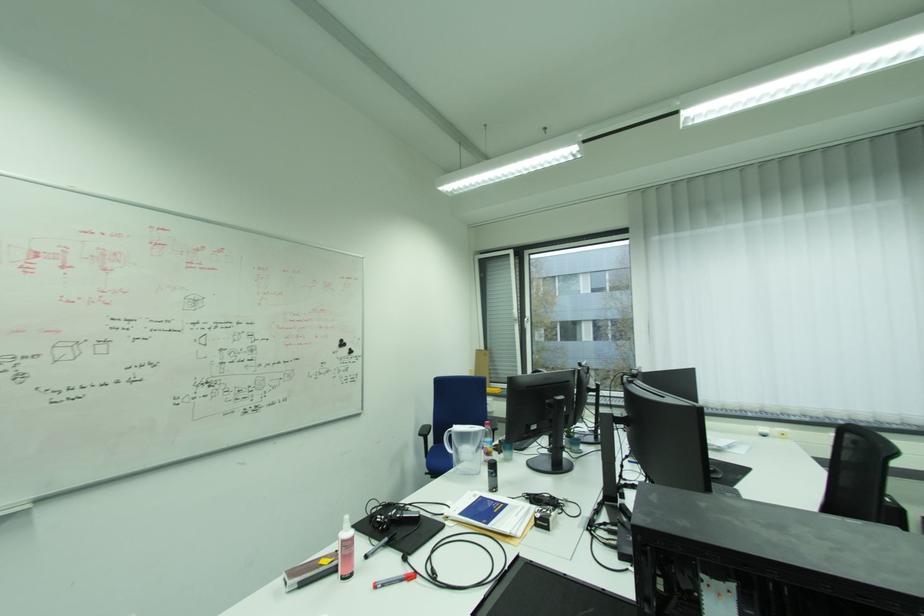
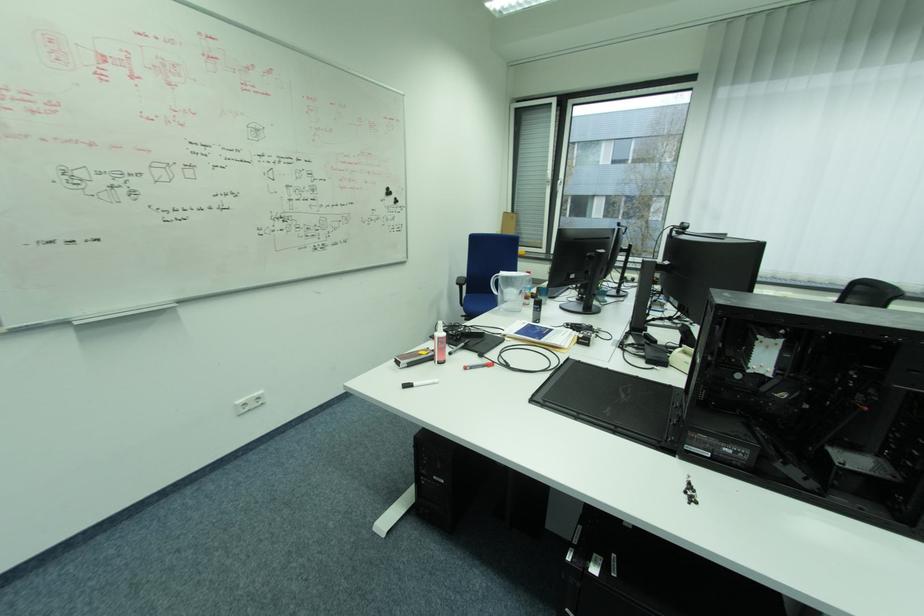
Question: How did the camera likely rotate?

Choices:
 (A) Left
 (B) Right
 (C) Up
 (D) Down

Answer: (D)